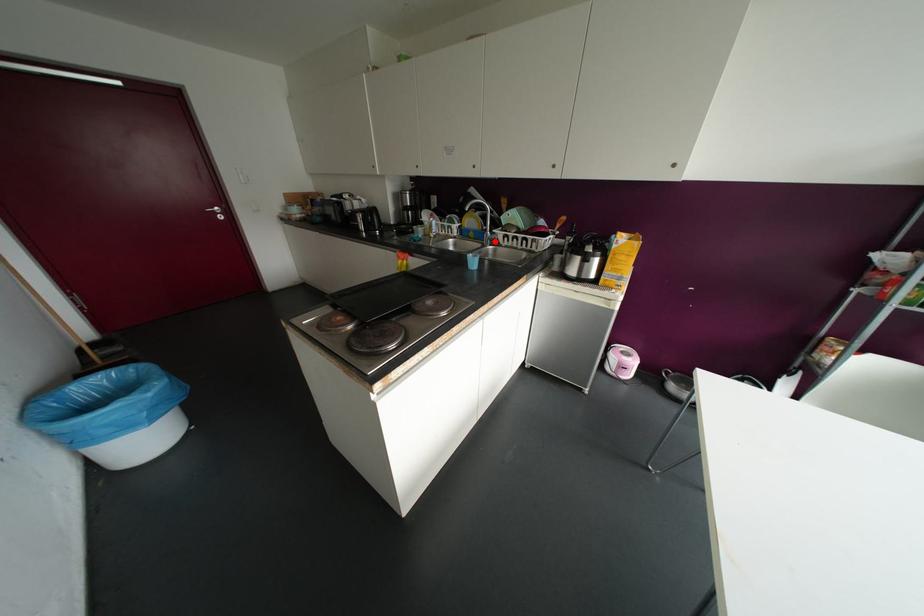
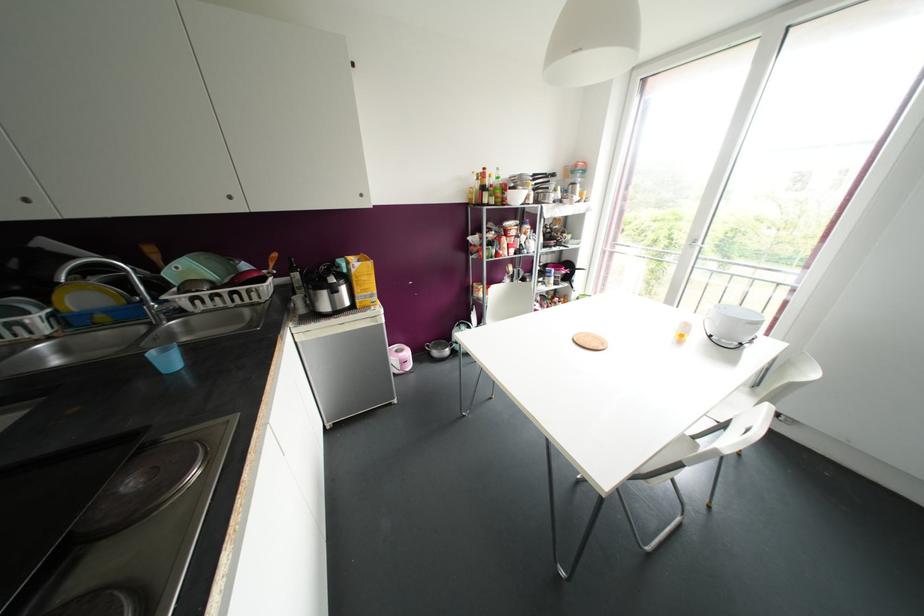
The point at the highlighted location is marked in the first image. Where is the corresponding point in the second image?

(178, 312)